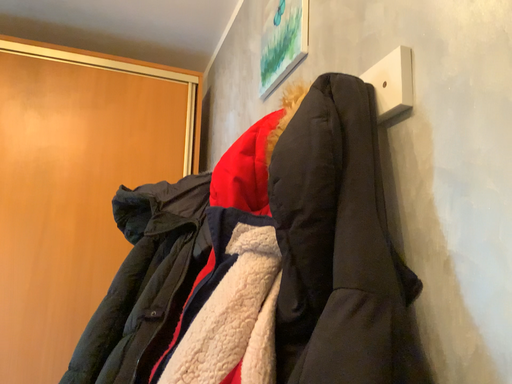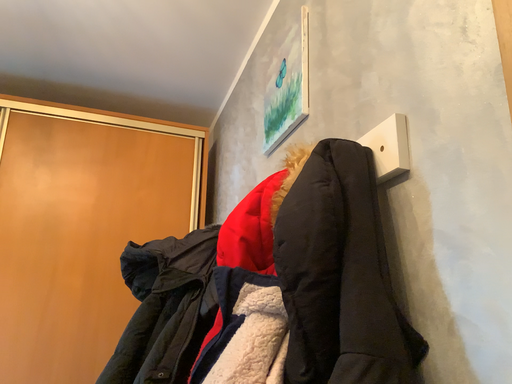
Question: How did the camera likely rotate when shooting the video?

Choices:
 (A) rotated downward
 (B) rotated upward

Answer: (B)